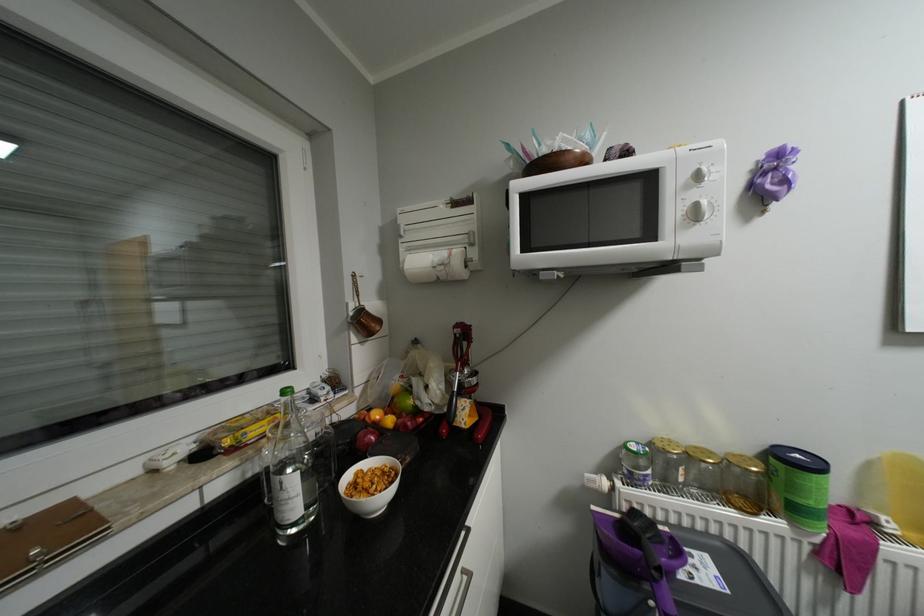
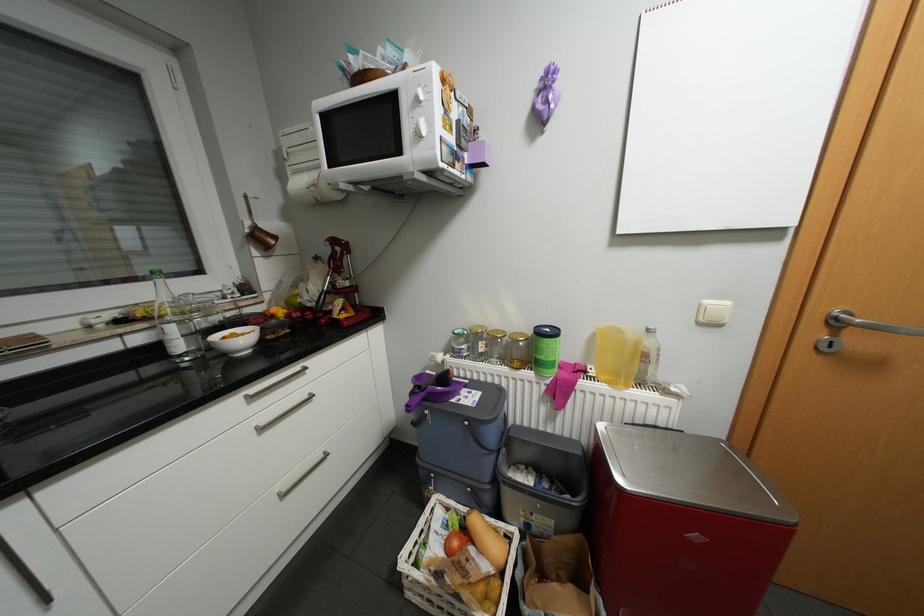
Question: The first image is from the beginning of the video and the second image is from the end. How did the camera likely rotate when shooting the video?

Choices:
 (A) Left
 (B) Right
 (C) Up
 (D) Down

Answer: (D)